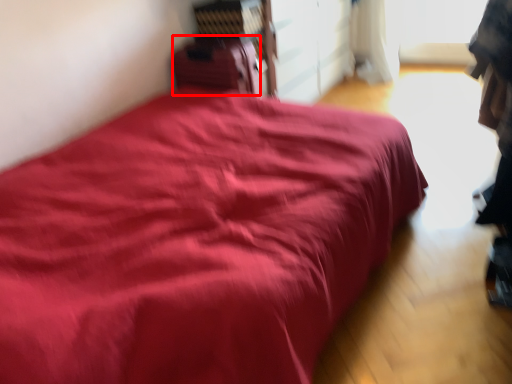
Question: Where is luggage (annotated by the red box) located in relation to bed in the image?

Choices:
 (A) right
 (B) left

Answer: (B)